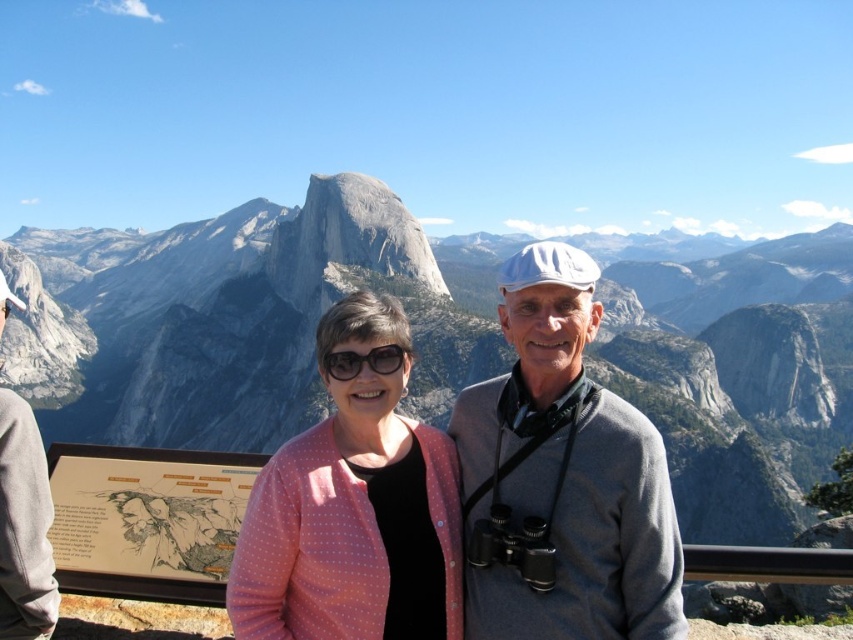
Image resolution: width=853 pixels, height=640 pixels. What do you see at coordinates (561, 477) in the screenshot? I see `gray wool sweater at center` at bounding box center [561, 477].

Can you confirm if gray wool sweater at center is bigger than gray/granite rock at center?

No.

This screenshot has height=640, width=853. Find the location of `gray wool sweater at center`. gray wool sweater at center is located at coordinates (561, 477).

Can you confirm if gray wool sweater at center is bigger than pink dotted cardigan at center?

Yes, gray wool sweater at center is bigger than pink dotted cardigan at center.

Is point (515, 541) more distant than point (378, 307)?

No, it is not.

The height and width of the screenshot is (640, 853). What do you see at coordinates (561, 477) in the screenshot?
I see `gray wool sweater at center` at bounding box center [561, 477].

Image resolution: width=853 pixels, height=640 pixels. Identify the location of gray wool sweater at center. tap(561, 477).

Between point (761, 308) and point (386, 352), which one is positioned behind?

Point (761, 308)

This screenshot has width=853, height=640. What do you see at coordinates (231, 320) in the screenshot?
I see `gray rock formation at center` at bounding box center [231, 320].

This screenshot has height=640, width=853. What are the coordinates of `gray rock formation at center` in the screenshot? It's located at (231, 320).